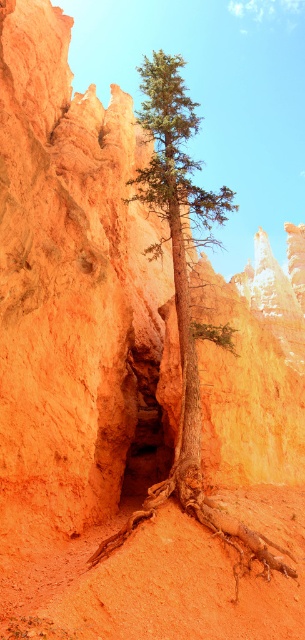
Question: From the image, what is the correct spatial relationship of green matte tree at center in relation to brown rough tree root at center?

Choices:
 (A) above
 (B) below

Answer: (A)

Question: Is brown rough tree root at center in front of brown rough tree root at lower center?

Choices:
 (A) no
 (B) yes

Answer: (B)

Question: Does green matte tree at center appear on the right side of brown rough tree root at center?

Choices:
 (A) yes
 (B) no

Answer: (B)

Question: Considering the real-world distances, which object is farthest from the green matte tree at center?

Choices:
 (A) brown rough tree root at lower center
 (B) brown rough tree root at center

Answer: (A)

Question: Which object is farther from the camera taking this photo?

Choices:
 (A) green matte tree at center
 (B) brown rough tree root at lower center

Answer: (A)

Question: Which of the following is the farthest from the observer?

Choices:
 (A) (200, 513)
 (B) (229, 208)

Answer: (B)